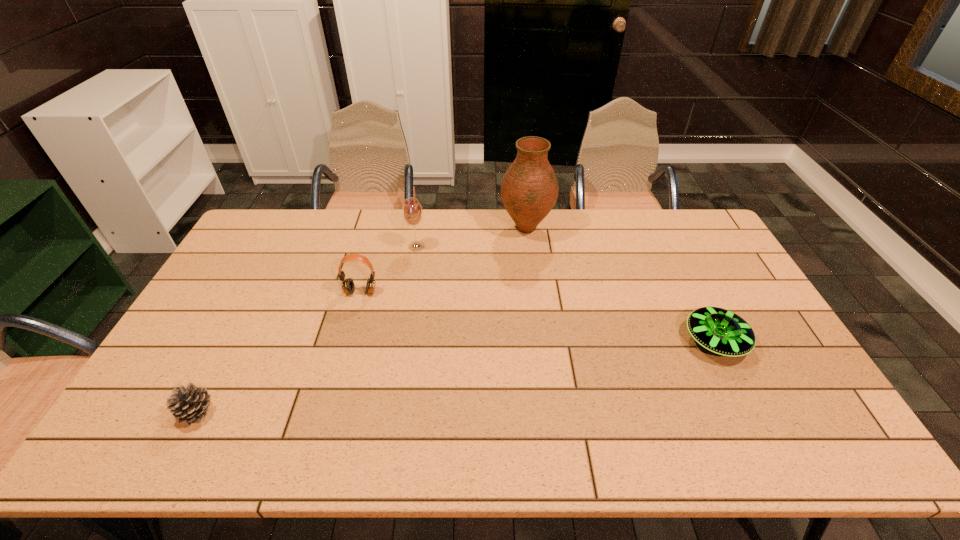
Find the location of `object that is at the near left corner`. object that is at the near left corner is located at coordinates (190, 404).

The width and height of the screenshot is (960, 540). In the image, there is a desktop. In order to click on free space at the far edge in this screenshot , I will do click(576, 233).

I want to click on vacant position at the near edge of the desktop, so click(680, 442).

The image size is (960, 540). In the image, there is a desktop. In order to click on vacant region at the left edge in this screenshot , I will do [x=181, y=346].

In the image, there is a desktop. Identify the location of free space at the right edge. Image resolution: width=960 pixels, height=540 pixels. (784, 407).

In the image, there is a desktop. Where is `vacant space at the near left corner`? The height and width of the screenshot is (540, 960). vacant space at the near left corner is located at coordinates (182, 440).

The image size is (960, 540). Identify the location of vacant area at the far right corner. (689, 230).

Where is `free space that is in between the saucer and the second object from left to right`? The height and width of the screenshot is (540, 960). free space that is in between the saucer and the second object from left to right is located at coordinates (538, 316).

Where is `vacant point located between the nearest object and the vase`? vacant point located between the nearest object and the vase is located at coordinates (361, 320).

Locate an element on the screen. free space between the vase and the wineglass is located at coordinates (471, 238).